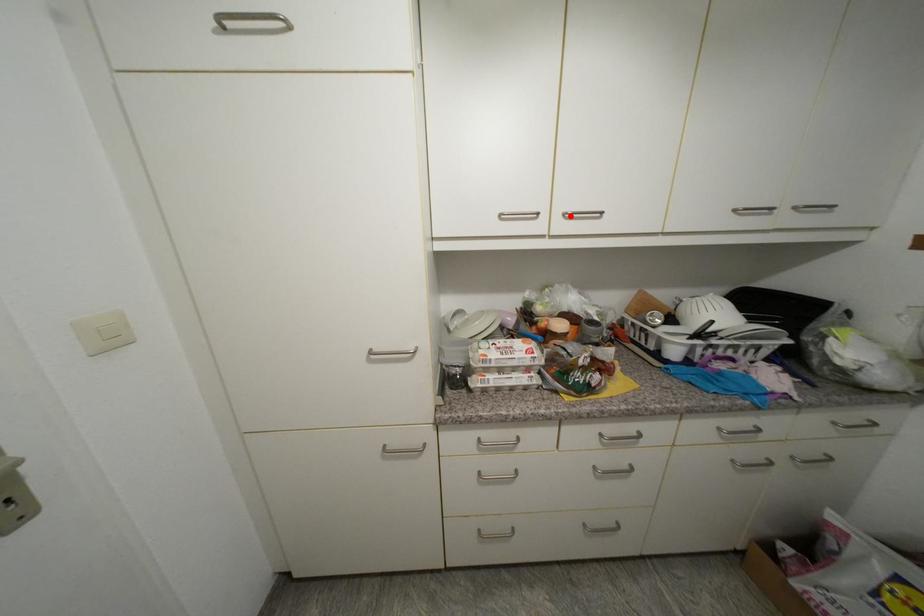
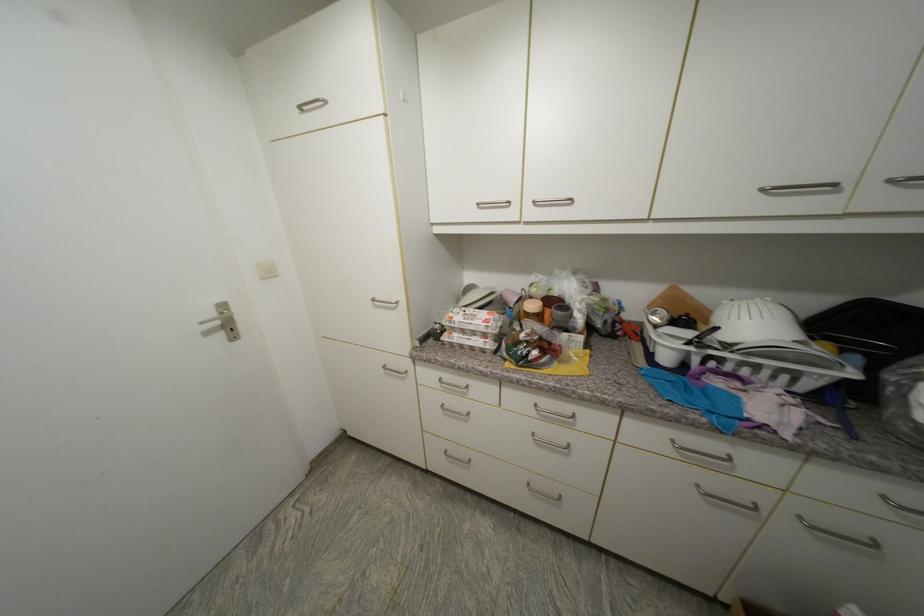
The point at the highlighted location is marked in the first image. Where is the corresponding point in the second image?

(540, 204)